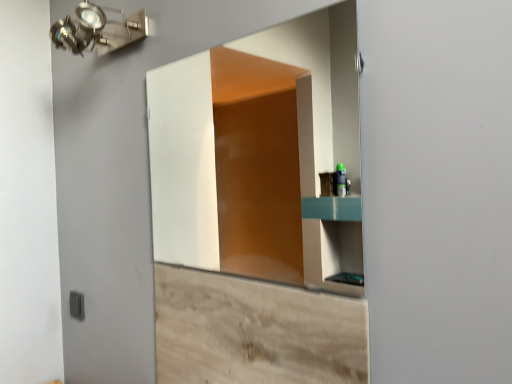
Locate an element on the screen. metallic wall-mounted light fixture at upper left is located at coordinates (98, 30).

Where is `matte glass mirror at center`? Image resolution: width=512 pixels, height=384 pixels. matte glass mirror at center is located at coordinates (262, 155).

What do you see at coordinates (254, 331) in the screenshot? I see `wooden cabinet at lower center` at bounding box center [254, 331].

In order to face gray plastic light switch at lower left, should I rotate leftwards or rightwards?

It's best to rotate left around 22.817 degrees.

Describe the element at coordinates (77, 305) in the screenshot. I see `gray plastic light switch at lower left` at that location.

Locate an element on the screen. Image resolution: width=512 pixels, height=384 pixels. metallic wall-mounted light fixture at upper left is located at coordinates (98, 30).

Is metallic wall-mounted light fixture at upper left positioned beyond the bounds of gray plastic light switch at lower left?

Yes, metallic wall-mounted light fixture at upper left is outside of gray plastic light switch at lower left.

What's the angular difference between metallic wall-mounted light fixture at upper left and gray plastic light switch at lower left's facing directions?

The facing directions of metallic wall-mounted light fixture at upper left and gray plastic light switch at lower left are 0.511 degrees apart.

Which is behind, metallic wall-mounted light fixture at upper left or gray plastic light switch at lower left?

gray plastic light switch at lower left is more distant.

Is metallic wall-mounted light fixture at upper left aimed at gray plastic light switch at lower left?

No, metallic wall-mounted light fixture at upper left is not oriented towards gray plastic light switch at lower left.

Where is `light switch lying on the left of wooden cabinet at lower center`? The width and height of the screenshot is (512, 384). light switch lying on the left of wooden cabinet at lower center is located at coordinates (77, 305).

Is wooden cabinet at lower center next to gray plastic light switch at lower left and touching it?

wooden cabinet at lower center and gray plastic light switch at lower left are clearly separated.

Which is more distant, (202, 271) or (81, 310)?

Point (81, 310)

Could you tell me if wooden cabinet at lower center is turned towards gray plastic light switch at lower left?

No, wooden cabinet at lower center is not aimed at gray plastic light switch at lower left.

Which is more to the right, matte glass mirror at center or metallic wall-mounted light fixture at upper left?

matte glass mirror at center.

Find the location of `mirror located underneath the metallic wall-mounted light fixture at upper left (from a real-world perspective)`. mirror located underneath the metallic wall-mounted light fixture at upper left (from a real-world perspective) is located at coordinates click(262, 155).

You are a GUI agent. You are given a task and a screenshot of the screen. Output one action in this format:
    pyautogui.click(x=<x>, y=<y>)
    Task: Click on the light fixture behind the wooden cabinet at lower center
    This screenshot has height=384, width=512.
    Given the screenshot: What is the action you would take?
    pyautogui.click(x=98, y=30)

Considering the relative sizes of metallic wall-mounted light fixture at upper left and wooden cabinet at lower center in the image provided, is metallic wall-mounted light fixture at upper left bigger than wooden cabinet at lower center?

Yes.

Is metallic wall-mounted light fixture at upper left positioned with its back to wooden cabinet at lower center?

metallic wall-mounted light fixture at upper left does not have its back to wooden cabinet at lower center.

Considering the relative positions of metallic wall-mounted light fixture at upper left and wooden cabinet at lower center in the image provided, is metallic wall-mounted light fixture at upper left to the left of wooden cabinet at lower center from the viewer's perspective?

Yes, metallic wall-mounted light fixture at upper left is to the left of wooden cabinet at lower center.

Between gray plastic light switch at lower left and matte glass mirror at center, which one has smaller width?

gray plastic light switch at lower left.

Which is further, (74, 301) or (350, 11)?

The point (350, 11) is behind.

Is gray plastic light switch at lower left oriented towards matte glass mirror at center?

No, gray plastic light switch at lower left is not turned towards matte glass mirror at center.

Where is `mirror above the gray plastic light switch at lower left (from the image's perspective)`? The height and width of the screenshot is (384, 512). mirror above the gray plastic light switch at lower left (from the image's perspective) is located at coordinates (262, 155).

From the image's perspective, who appears lower, wooden cabinet at lower center or matte glass mirror at center?

wooden cabinet at lower center is shown below in the image.

Is wooden cabinet at lower center positioned before matte glass mirror at center?

That is True.

Considering the sizes of objects wooden cabinet at lower center and matte glass mirror at center in the image provided, who is taller, wooden cabinet at lower center or matte glass mirror at center?

With more height is matte glass mirror at center.

Would you say wooden cabinet at lower center is outside matte glass mirror at center?

Yes, wooden cabinet at lower center is outside of matte glass mirror at center.

Can you confirm if wooden cabinet at lower center is taller than metallic wall-mounted light fixture at upper left?

Correct, wooden cabinet at lower center is much taller as metallic wall-mounted light fixture at upper left.

Does wooden cabinet at lower center appear on the right side of metallic wall-mounted light fixture at upper left?

Yes.

Is wooden cabinet at lower center in front of or behind metallic wall-mounted light fixture at upper left in the image?

Clearly, wooden cabinet at lower center is in front of metallic wall-mounted light fixture at upper left.

The height and width of the screenshot is (384, 512). Find the location of `light fixture located above the gray plastic light switch at lower left (from the image's perspective)`. light fixture located above the gray plastic light switch at lower left (from the image's perspective) is located at coordinates (98, 30).

The image size is (512, 384). What are the coordinates of `cabinetry that is above the gray plastic light switch at lower left (from a real-world perspective)` in the screenshot? It's located at (254, 331).

Looking at the image, which one is located closer to gray plastic light switch at lower left, metallic wall-mounted light fixture at upper left or matte glass mirror at center?

metallic wall-mounted light fixture at upper left is closer to gray plastic light switch at lower left.

Which object lies nearer to the anchor point wooden cabinet at lower center, metallic wall-mounted light fixture at upper left or gray plastic light switch at lower left?

gray plastic light switch at lower left lies closer to wooden cabinet at lower center than the other object.

Which object lies further to the anchor point wooden cabinet at lower center, gray plastic light switch at lower left or metallic wall-mounted light fixture at upper left?

metallic wall-mounted light fixture at upper left lies further to wooden cabinet at lower center than the other object.

From the image, which object appears to be nearer to metallic wall-mounted light fixture at upper left, matte glass mirror at center or gray plastic light switch at lower left?

The object closer to metallic wall-mounted light fixture at upper left is gray plastic light switch at lower left.

From the image, which object appears to be nearer to matte glass mirror at center, wooden cabinet at lower center or metallic wall-mounted light fixture at upper left?

metallic wall-mounted light fixture at upper left.

Based on their spatial positions, is metallic wall-mounted light fixture at upper left or wooden cabinet at lower center closer to gray plastic light switch at lower left?

wooden cabinet at lower center is closer to gray plastic light switch at lower left.

In the scene shown: Looking at the image, which one is located closer to gray plastic light switch at lower left, matte glass mirror at center or metallic wall-mounted light fixture at upper left?

metallic wall-mounted light fixture at upper left is closer to gray plastic light switch at lower left.

Looking at the image, which one is located further to wooden cabinet at lower center, metallic wall-mounted light fixture at upper left or matte glass mirror at center?

matte glass mirror at center lies further to wooden cabinet at lower center than the other object.

Image resolution: width=512 pixels, height=384 pixels. What are the coordinates of `mirror between metallic wall-mounted light fixture at upper left and wooden cabinet at lower center from top to bottom` in the screenshot? It's located at (262, 155).

Locate an element on the screen. mirror between metallic wall-mounted light fixture at upper left and gray plastic light switch at lower left from top to bottom is located at coordinates (262, 155).

This screenshot has width=512, height=384. Find the location of `cabinetry between metallic wall-mounted light fixture at upper left and gray plastic light switch at lower left in the up-down direction`. cabinetry between metallic wall-mounted light fixture at upper left and gray plastic light switch at lower left in the up-down direction is located at coordinates (254, 331).

The image size is (512, 384). What are the coordinates of `mirror between wooden cabinet at lower center and gray plastic light switch at lower left along the z-axis` in the screenshot? It's located at (262, 155).